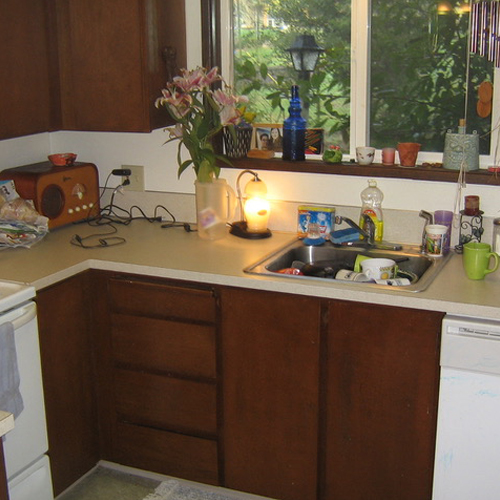
At what (x,y) coordinates should I click in order to perform the action: click on filled kitchen sink. Please return your answer as a coordinate pair (x, y). Looking at the image, I should click on (312, 255).